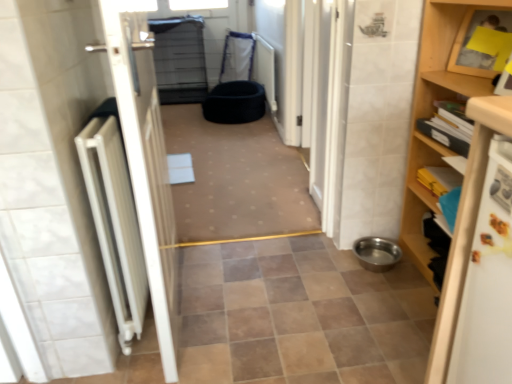
This screenshot has height=384, width=512. What are the coordinates of `free point in front of black fabric pet bed at center, the 2th toilet bowl in the front-to-back sequence` in the screenshot? It's located at (234, 137).